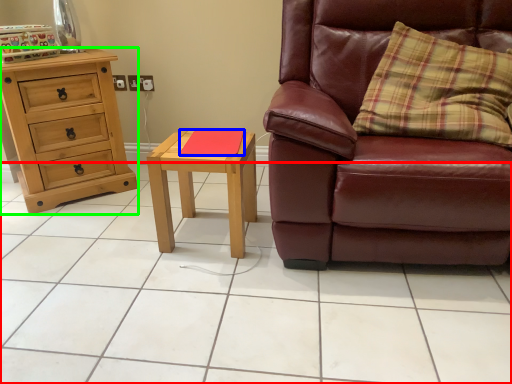
Question: Estimate the real-world distances between objects in this image. Which object is closer to ceramic tile (highlighted by a red box), pad (highlighted by a blue box) or chest of drawers (highlighted by a green box)?

Choices:
 (A) pad
 (B) chest of drawers

Answer: (A)